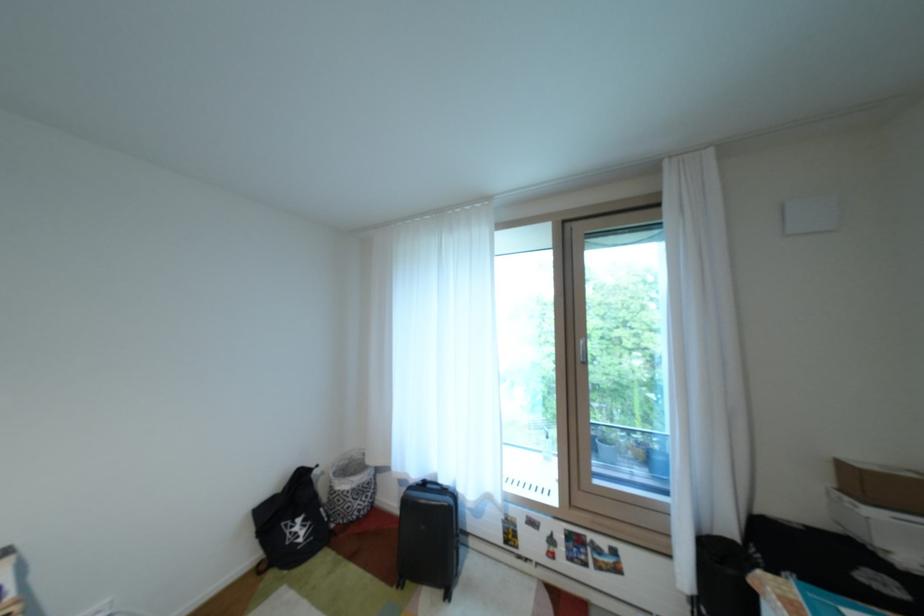
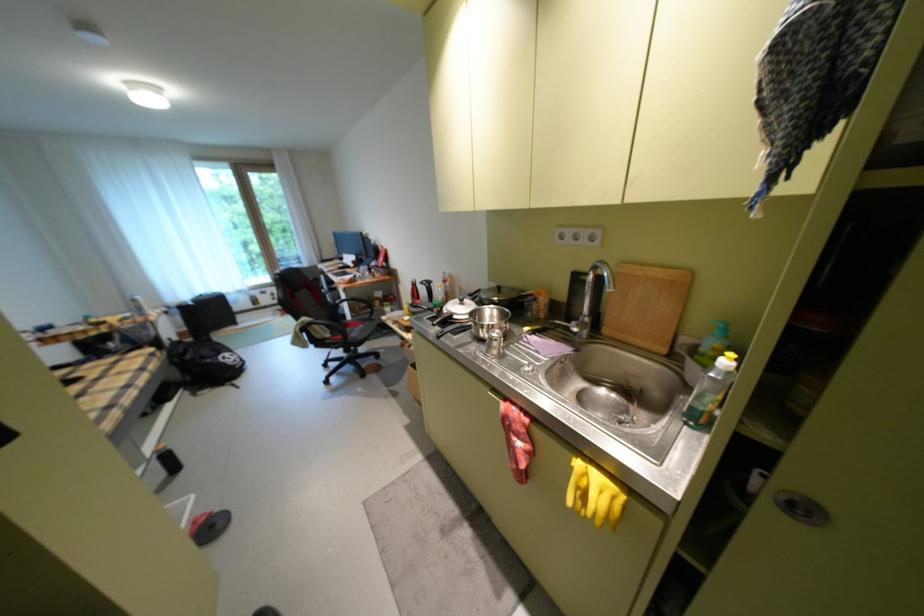
In the second image, find the point that corresponds to point (554, 533) in the first image.

(280, 294)